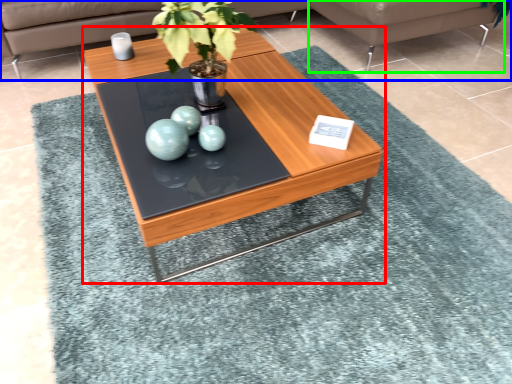
Question: Based on their relative distances, which object is farther from coffee table (highlighted by a red box)? Choose from studio couch (highlighted by a blue box) and couch (highlighted by a green box).

Choices:
 (A) studio couch
 (B) couch

Answer: (A)